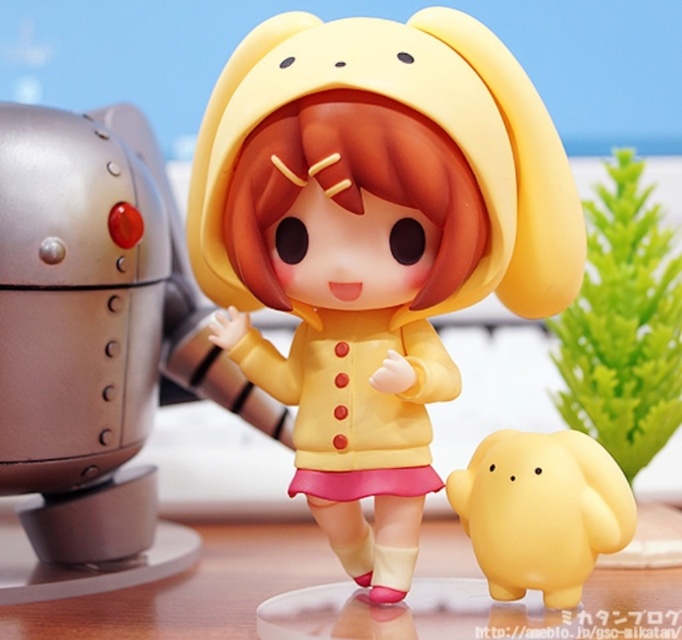
You are a collector who wants to display the yellow matte doll at center and the brushed metal robot at left in a showcase. Based on their positions in the image, which object should be placed higher up on the shelf to maintain the same spatial relationship?

The yellow matte doll at center should be placed higher up on the shelf than the brushed metal robot at left to maintain the same spatial relationship since the yellow matte doll at center is above the brushed metal robot at left in the image.

You are a collector who wants to display the yellow matte doll at center and the brushed metal robot at left on a shelf. The shelf has a width of 30 cm. Can both items fit side by side without overlapping?

The yellow matte doll at center might be wider than the brushed metal robot at left, but without exact measurements, it is uncertain if their combined width exceeds 30 cm. Check their individual widths to confirm.